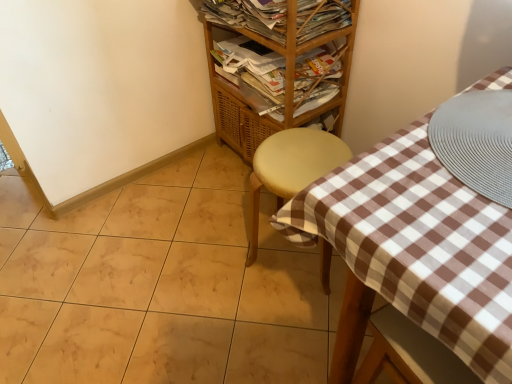
Image resolution: width=512 pixels, height=384 pixels. I want to click on vacant space situated on the left part of matte yellow stool at center, so click(x=215, y=256).